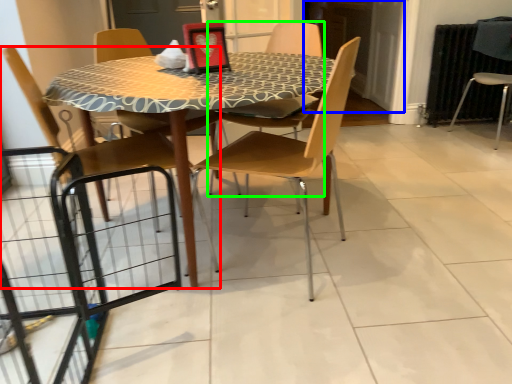
Question: Based on their relative distances, which object is farther from chair (highlighted by a red box)? Choose from screen door (highlighted by a blue box) and chair (highlighted by a green box).

Choices:
 (A) screen door
 (B) chair

Answer: (A)